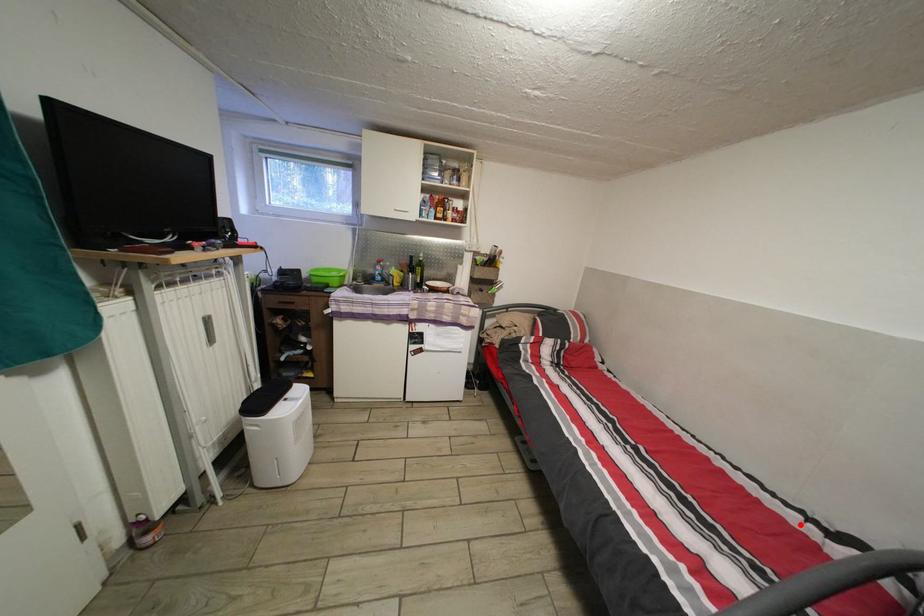
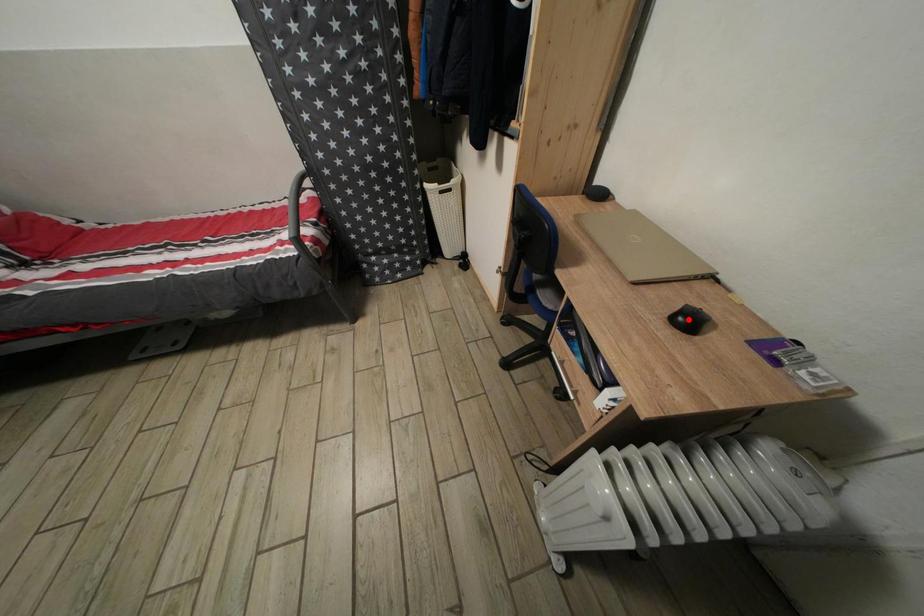
I am providing you with two images of the same scene from different viewpoints. A red point is marked on the first image and another point is marked on the second image. Do the highlighted points in image1 and image2 indicate the same real-world spot?

No